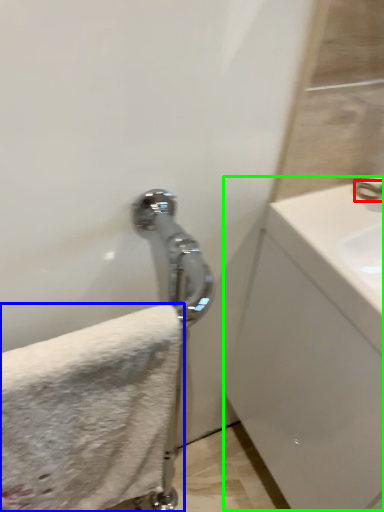
Question: Which object is the farthest from faucet (highlighted by a red box)? Choose among these: towel (highlighted by a blue box) or counter top (highlighted by a green box).

Choices:
 (A) towel
 (B) counter top

Answer: (A)